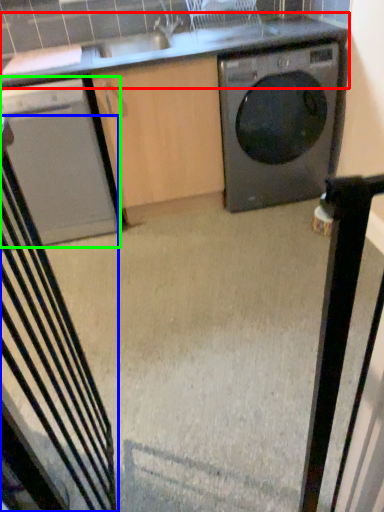
Question: Which object is the closest to the countertop (highlighted by a red box)? Choose among these: rocking chair (highlighted by a blue box) or home appliance (highlighted by a green box).

Choices:
 (A) rocking chair
 (B) home appliance

Answer: (B)